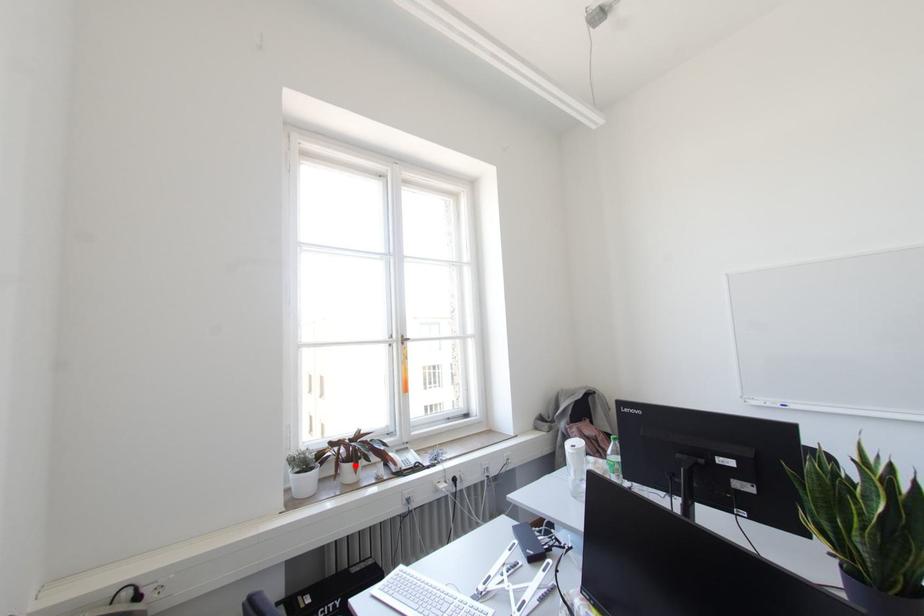
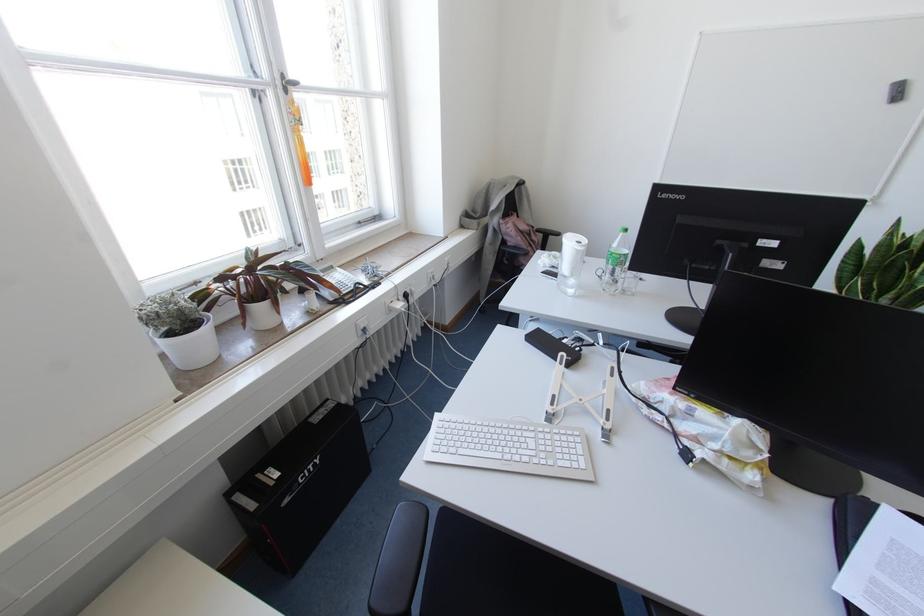
Question: A red point is marked in image1. In image2, is the corresponding 3D point closer to the camera or farther? Reply with the corresponding letter.

Choices:
 (A) The corresponding 3D point is closer.
 (B) The corresponding 3D point is farther.

Answer: (A)